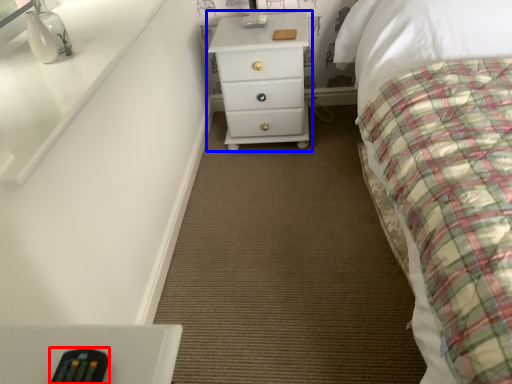
Question: Which object appears closest to the camera in this image, remote (highlighted by a red box) or chest of drawers (highlighted by a blue box)?

Choices:
 (A) remote
 (B) chest of drawers

Answer: (A)